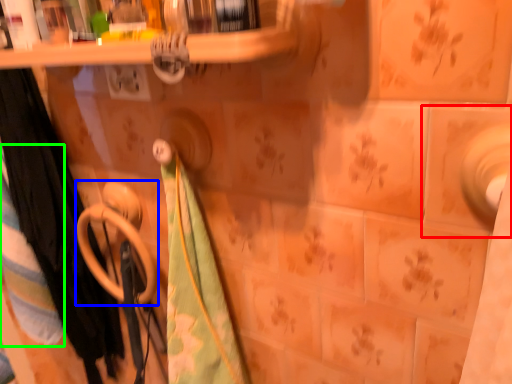
Question: Considering the real-world distances, which object is farthest from ceramic tile (highlighted by a red box)? towel rack (highlighted by a blue box) or beach towel (highlighted by a green box)?

Choices:
 (A) towel rack
 (B) beach towel

Answer: (B)